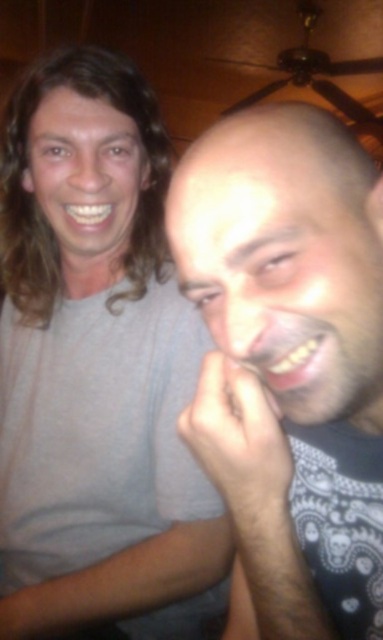
Is gray matte shirt at upper left below dark gray shirt at right?

No.

I want to click on gray matte shirt at upper left, so click(x=98, y=368).